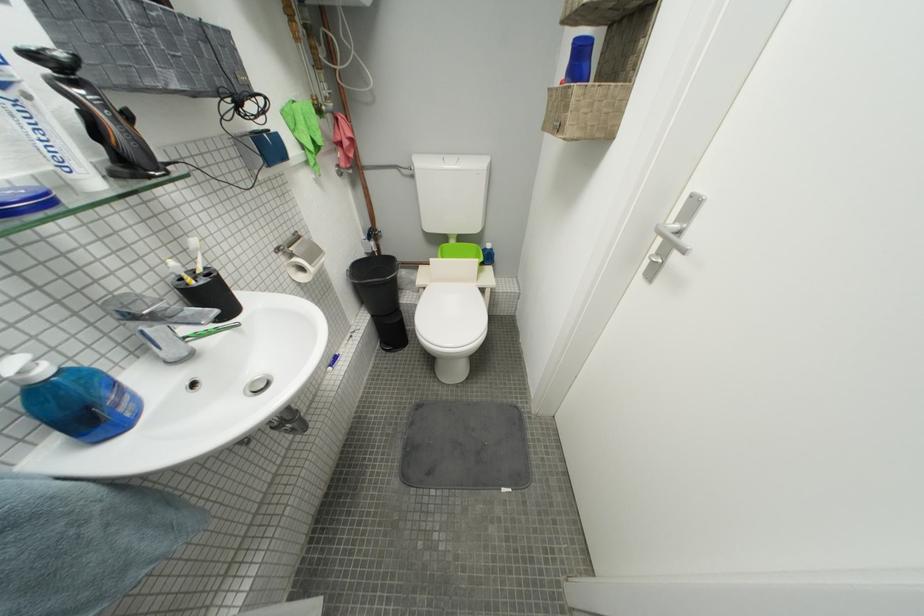
The location [197,257] corresponds to which object?

This point indicates the white toothbrush.